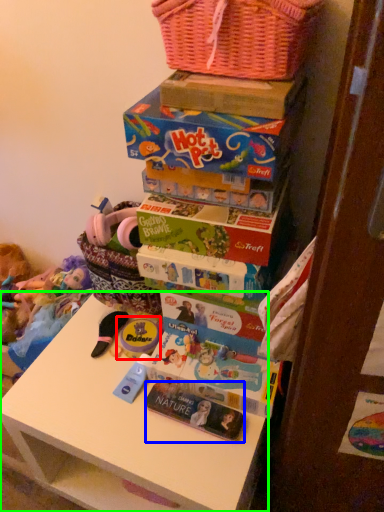
Question: Which is nearer to the toy (highlighted by a red box)? magazine (highlighted by a blue box) or table (highlighted by a green box).

Choices:
 (A) magazine
 (B) table

Answer: (A)